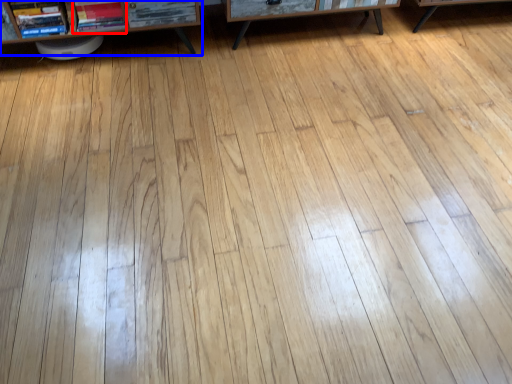
Question: Among these objects, which one is farthest to the camera, book (highlighted by a red box) or shelf (highlighted by a blue box)?

Choices:
 (A) book
 (B) shelf

Answer: (A)